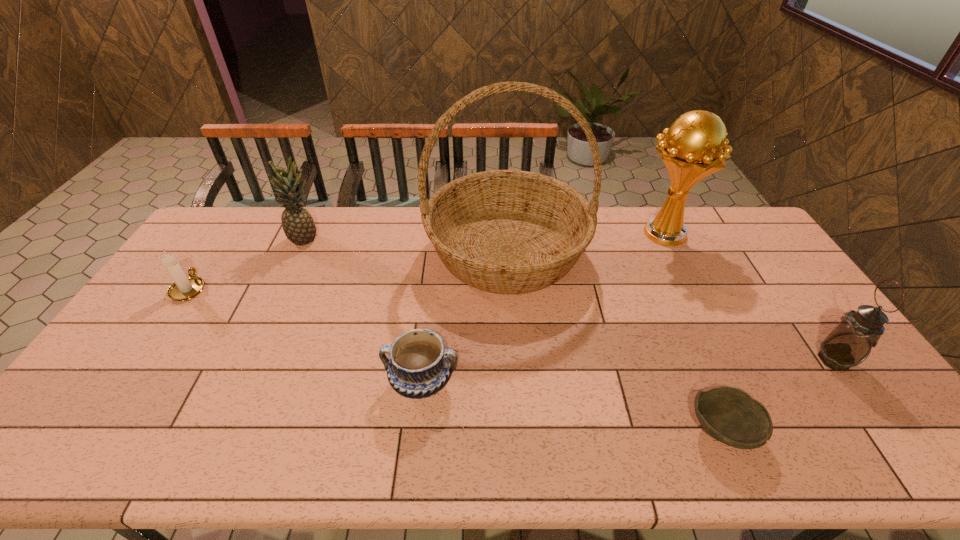
This screenshot has height=540, width=960. Find the location of `basket`. basket is located at coordinates click(503, 231).

Find the location of `the second tallest object`. the second tallest object is located at coordinates (692, 150).

Find the location of a particular element. The image size is (960, 540). the sixth object from right to left is located at coordinates (298, 225).

Where is `the rightmost object`? the rightmost object is located at coordinates [x=850, y=342].

The image size is (960, 540). Find the location of `the leftmost object`. the leftmost object is located at coordinates point(184,288).

Identify the location of the second shortest object. The width and height of the screenshot is (960, 540). (419, 367).

Identify the location of the shortest object. This screenshot has width=960, height=540. (730, 415).

Locate an element on the screen. This screenshot has height=540, width=960. vacant region located 0.100m on the front of the basket is located at coordinates (513, 336).

At what (x,y) coordinates should I click in order to perform the action: click on vacant region located at the front of the second tallest object where the globe is prominent. Please return your answer as a coordinate pair (x, y). Looking at the image, I should click on (586, 233).

Identify the location of free region located 0.170m at the front of the second tallest object where the globe is prominent. (586, 233).